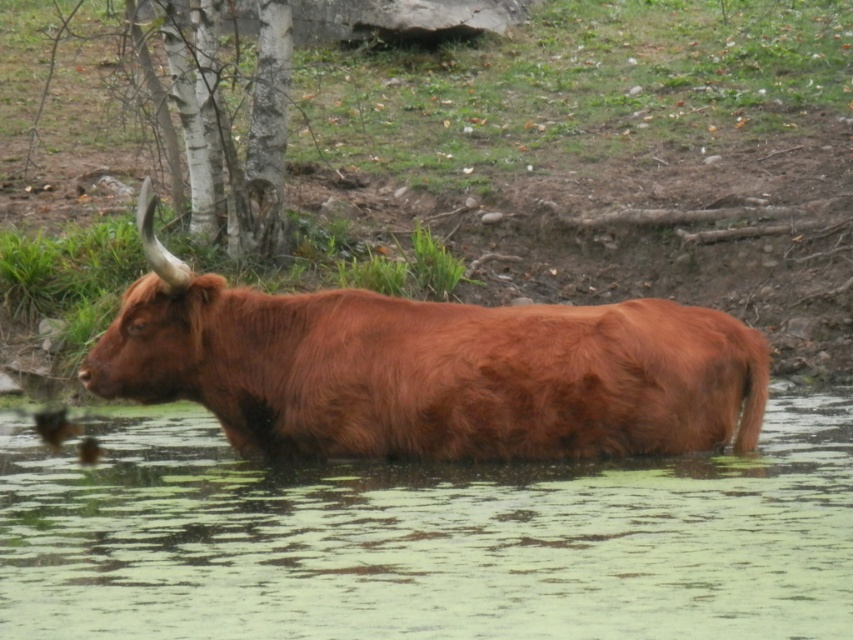
Who is more distant from viewer, [706,618] or [293,307]?

Point [293,307]

Is green algae water at lower center to the left of brown furry yak at center from the viewer's perspective?

Incorrect, green algae water at lower center is not on the left side of brown furry yak at center.

You are a GUI agent. You are given a task and a screenshot of the screen. Output one action in this format:
    pyautogui.click(x=<x>, y=<y>)
    Task: Click on the green algae water at lower center
    This screenshot has width=853, height=640.
    Given the screenshot: What is the action you would take?
    pyautogui.click(x=427, y=540)

Which of these two, brown furry yak at center or bark textured tree at upper left, stands shorter?

brown furry yak at center

Between brown furry yak at center and bark textured tree at upper left, which one is positioned higher?

bark textured tree at upper left is higher up.

Does point (93, 387) come behind point (178, 88)?

No.

Where is `brown furry yak at center`? brown furry yak at center is located at coordinates (428, 369).

Is green algae water at lower center above bark textured tree at upper left?

No, green algae water at lower center is not above bark textured tree at upper left.

Does green algae water at lower center have a smaller size compared to bark textured tree at upper left?

Indeed, green algae water at lower center has a smaller size compared to bark textured tree at upper left.

Locate an element on the screen. The image size is (853, 640). green algae water at lower center is located at coordinates 427,540.